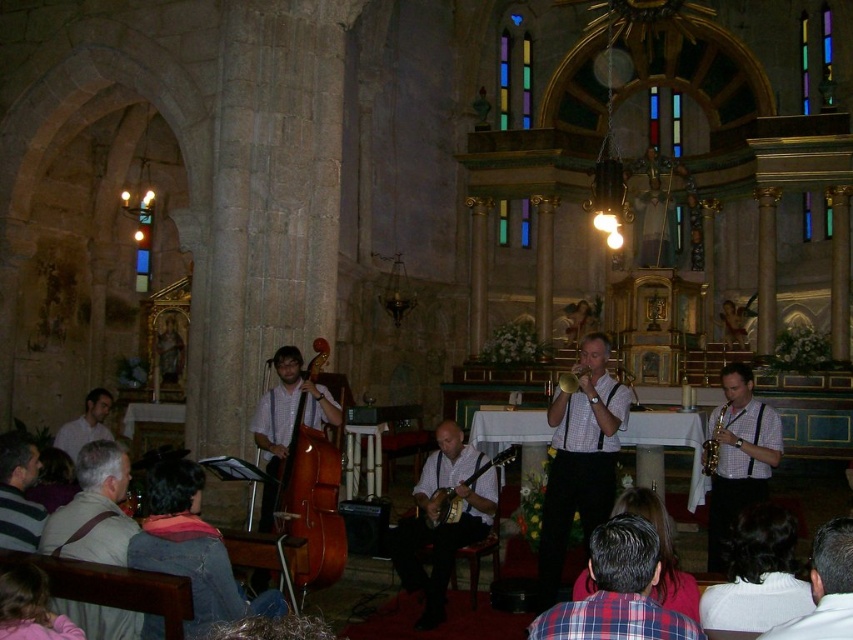
Is white shirt at left positioned behind gold metallic saxophone at center-right?

Yes, it is.

Between point (77, 435) and point (730, 420), which one is positioned in front?

Point (730, 420)

This screenshot has width=853, height=640. Find the location of `white shirt at left`. white shirt at left is located at coordinates (85, 422).

Can you confirm if plaid shirt at lower center is positioned above striped cotton shirt at lower left?

Indeed, plaid shirt at lower center is positioned over striped cotton shirt at lower left.

Does plaid shirt at lower center have a larger size compared to striped cotton shirt at lower left?

Indeed, plaid shirt at lower center has a larger size compared to striped cotton shirt at lower left.

Find the location of a particular element. This screenshot has height=640, width=853. plaid shirt at lower center is located at coordinates (618, 592).

Consider the image. Can you confirm if gray fabric shirt at lower left is smaller than matte white saxophone at center right?

Indeed, gray fabric shirt at lower left has a smaller size compared to matte white saxophone at center right.

Between point (91, 490) and point (721, 552), which one is positioned in front?

Positioned in front is point (91, 490).

Which is in front, point (86, 616) or point (726, 378)?

Point (86, 616) is more forward.

Image resolution: width=853 pixels, height=640 pixels. Identify the location of gray fabric shirt at lower left. (93, 509).